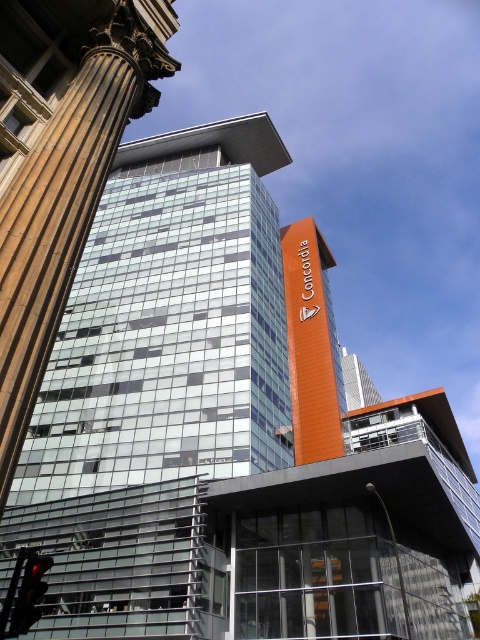
Question: Does orange matte sign at upper center lie in front of red glass traffic light at lower left?

Choices:
 (A) no
 (B) yes

Answer: (A)

Question: Does orange matte sign at upper center have a larger size compared to red glass traffic light at lower left?

Choices:
 (A) no
 (B) yes

Answer: (B)

Question: Is brown polished stone column at left to the right of red glass traffic light at lower left from the viewer's perspective?

Choices:
 (A) yes
 (B) no

Answer: (A)

Question: Which of these objects is positioned closest to the orange matte sign at upper center?

Choices:
 (A) brown polished stone column at left
 (B) red glass traffic light at lower left

Answer: (B)

Question: Among these objects, which one is farthest from the camera?

Choices:
 (A) orange matte sign at upper center
 (B) red glass traffic light at lower left

Answer: (A)

Question: Considering the real-world distances, which object is closest to the brown polished stone column at left?

Choices:
 (A) orange matte sign at upper center
 (B) red glass traffic light at lower left

Answer: (B)